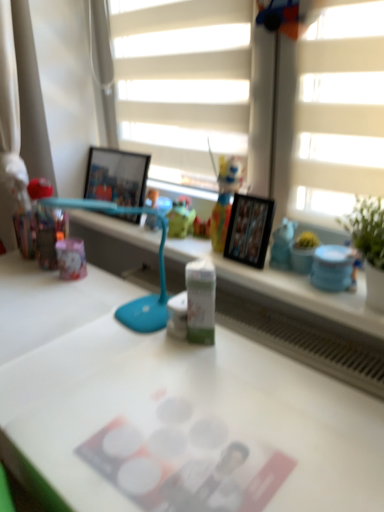
What do you see at coordinates (200, 301) in the screenshot? I see `green matte milk carton at center, placed as the 2th stationery when sorted from right to left` at bounding box center [200, 301].

This screenshot has width=384, height=512. Describe the element at coordinates (249, 230) in the screenshot. I see `wooden photo frame at center, the 1th picture frame ordered from the bottom` at that location.

Where is `white matte blind at upper center`? This screenshot has width=384, height=512. white matte blind at upper center is located at coordinates (182, 84).

Where is `teal plastic table lamp at center`? The width and height of the screenshot is (384, 512). teal plastic table lamp at center is located at coordinates (159, 266).

Describe the element at coordinates (332, 268) in the screenshot. The height and width of the screenshot is (512, 384). I see `blue glossy jar at upper right, which is the second stationery from left to right` at that location.

Locate an element on the screen. translucent plastic toy at center is located at coordinates (225, 199).

Is point (97, 174) farther from camera compared to point (162, 105)?

Yes, it is behind point (162, 105).

Looking at this image, does wooden photo frame at upper center, the first picture frame from the back, turn towards white matte blind at upper center?

No, wooden photo frame at upper center, the first picture frame from the back, is not turned towards white matte blind at upper center.

At what (x,y) coordinates should I click in order to perform the action: click on picture frame located on the left of white matte blind at upper center. Please return your answer as a coordinate pair (x, y). Image resolution: width=384 pixels, height=512 pixels. Looking at the image, I should click on (116, 176).

Does white matte blind at upper center have a larger size compared to green matte milk carton at center, the 1th stationery when ordered from left to right?

Yes, white matte blind at upper center is bigger than green matte milk carton at center, the 1th stationery when ordered from left to right.

Is white matte blind at upper center inside the boundaries of green matte milk carton at center, placed as the 2th stationery when sorted from right to left, or outside?

white matte blind at upper center cannot be found inside green matte milk carton at center, placed as the 2th stationery when sorted from right to left.

In the image, is green matte milk carton at center, the 1th stationery when ordered from left to right, on the left side or the right side of teal plastic table lamp at center?

green matte milk carton at center, the 1th stationery when ordered from left to right, is positioned on teal plastic table lamp at center's right side.

Who is taller, green matte milk carton at center, the 1th stationery when ordered from left to right, or teal plastic table lamp at center?

With more height is teal plastic table lamp at center.

Is green matte milk carton at center, placed as the 2th stationery when sorted from right to left, far from teal plastic table lamp at center?

No, green matte milk carton at center, placed as the 2th stationery when sorted from right to left, is not far away from teal plastic table lamp at center.

Does green matte milk carton at center, the 1th stationery when ordered from left to right, have a larger size compared to teal plastic table lamp at center?

Incorrect, green matte milk carton at center, the 1th stationery when ordered from left to right, is not larger than teal plastic table lamp at center.

From the image's perspective, is blue glossy jar at upper right, which is the second stationery from left to right, beneath teal plastic table lamp at center?

Indeed, from the image's perspective, blue glossy jar at upper right, which is the second stationery from left to right, is shown beneath teal plastic table lamp at center.

Who is bigger, blue glossy jar at upper right, which is the second stationery from left to right, or teal plastic table lamp at center?

teal plastic table lamp at center is bigger.

From a real-world perspective, is blue glossy jar at upper right, the first stationery in the right-to-left sequence, located beneath teal plastic table lamp at center?

Yes.

Consider the image. Relative to teal plastic table lamp at center, is blue glossy jar at upper right, which is the second stationery from left to right, in front or behind?

Visually, blue glossy jar at upper right, which is the second stationery from left to right, is located behind teal plastic table lamp at center.

Is teal plastic table lamp at center positioned in front of translucent plastic toy at center?

Yes, it is in front of translucent plastic toy at center.

Considering the positions of objects teal plastic table lamp at center and translucent plastic toy at center in the image provided, who is more to the left, teal plastic table lamp at center or translucent plastic toy at center?

From the viewer's perspective, teal plastic table lamp at center appears more on the left side.

Between teal plastic table lamp at center and translucent plastic toy at center, which one has less height?

With less height is translucent plastic toy at center.

Is teal plastic table lamp at center next to translucent plastic toy at center?

No, teal plastic table lamp at center is not in contact with translucent plastic toy at center.

Which is farther from the camera, (211, 224) or (319, 275)?

The point (211, 224) is behind.

Is translucent plastic toy at center oriented towards blue glossy jar at upper right, the first stationery in the right-to-left sequence?

No, translucent plastic toy at center is not aimed at blue glossy jar at upper right, the first stationery in the right-to-left sequence.

Would you consider translucent plastic toy at center to be distant from blue glossy jar at upper right, which is the second stationery from left to right?

They are positioned close to each other.

Who is smaller, translucent plastic toy at center or blue glossy jar at upper right, which is the second stationery from left to right?

blue glossy jar at upper right, which is the second stationery from left to right, is smaller.

Which point is more forward, (332, 267) or (45, 382)?

→ The point (45, 382) is closer.

Can you confirm if blue glossy jar at upper right, the first stationery in the right-to-left sequence, is taller than white matte desk at center?

No, blue glossy jar at upper right, the first stationery in the right-to-left sequence, is not taller than white matte desk at center.

Could you measure the distance between blue glossy jar at upper right, the first stationery in the right-to-left sequence, and white matte desk at center?

The distance of blue glossy jar at upper right, the first stationery in the right-to-left sequence, from white matte desk at center is 17.29 inches.

Between blue glossy jar at upper right, the first stationery in the right-to-left sequence, and white matte desk at center, which one appears on the right side from the viewer's perspective?

blue glossy jar at upper right, the first stationery in the right-to-left sequence.

Locate an element on the screen. This screenshot has height=512, width=384. blind above the wooden photo frame at upper center, the first picture frame from the back (from a real-world perspective) is located at coordinates [182, 84].

From the image's perspective, starting from the white matte blind at upper center, which stationery is the 2nd one below? Please provide its 2D coordinates.

[(200, 301)]

When comparing their distances from white matte desk at center, does wooden photo frame at upper center, the 2th picture frame in the bottom-to-top sequence, or teal plastic table lamp at center seem closer?

teal plastic table lamp at center is closer to white matte desk at center.

Based on their spatial positions, is teal plastic table lamp at center or wooden photo frame at upper center, which appears as the 2th picture frame when viewed from the right, further from white matte desk at center?

wooden photo frame at upper center, which appears as the 2th picture frame when viewed from the right, lies further to white matte desk at center than the other object.

From the image, which object appears to be nearer to wooden photo frame at upper center, the 2th picture frame in the bottom-to-top sequence, wooden photo frame at center, the 1th picture frame ordered from the bottom, or white matte desk at center?

The object closer to wooden photo frame at upper center, the 2th picture frame in the bottom-to-top sequence, is wooden photo frame at center, the 1th picture frame ordered from the bottom.

Based on their spatial positions, is teal plastic table lamp at center or green matte milk carton at center, placed as the 2th stationery when sorted from right to left, further from white matte blind at upper center?

green matte milk carton at center, placed as the 2th stationery when sorted from right to left.

When comparing their distances from white matte blind at upper center, does translucent plastic toy at center or teal plastic table lamp at center seem further?

Among the two, teal plastic table lamp at center is located further to white matte blind at upper center.

Looking at the image, which one is located further to wooden photo frame at center, marked as the 1th picture frame in a front-to-back arrangement, wooden photo frame at upper center, the 2th picture frame in the bottom-to-top sequence, or white matte desk at center?

wooden photo frame at upper center, the 2th picture frame in the bottom-to-top sequence.

From the picture: Which object lies further to the anchor point wooden photo frame at center, the 2th picture frame viewed from the back, white matte desk at center or translucent plastic toy at center?

white matte desk at center is further to wooden photo frame at center, the 2th picture frame viewed from the back.

From the image, which object appears to be farther from white matte desk at center, white matte blind at upper center or blue glossy jar at upper right, the first stationery in the right-to-left sequence?

white matte blind at upper center lies further to white matte desk at center than the other object.

Where is `blind positioned between teal plastic table lamp at center and wooden photo frame at upper center, arranged as the 1th picture frame when viewed from the left, from near to far`? This screenshot has width=384, height=512. blind positioned between teal plastic table lamp at center and wooden photo frame at upper center, arranged as the 1th picture frame when viewed from the left, from near to far is located at coordinates (182, 84).

At what (x,y) coordinates should I click in order to perform the action: click on toy situated between wooden photo frame at upper center, arranged as the 1th picture frame when viewed from the left, and wooden photo frame at center, the 1th picture frame ordered from the bottom, from left to right. Please return your answer as a coordinate pair (x, y). The image size is (384, 512). Looking at the image, I should click on (225, 199).

Find the location of a particular element. The height and width of the screenshot is (512, 384). toy between teal plastic table lamp at center and wooden photo frame at upper center, arranged as the 1th picture frame when viewed from the left, in the front-back direction is located at coordinates (225, 199).

Where is `table lamp between white matte desk at center and wooden photo frame at upper center, the 2th picture frame in the bottom-to-top sequence, in the front-back direction`? table lamp between white matte desk at center and wooden photo frame at upper center, the 2th picture frame in the bottom-to-top sequence, in the front-back direction is located at coordinates (159, 266).